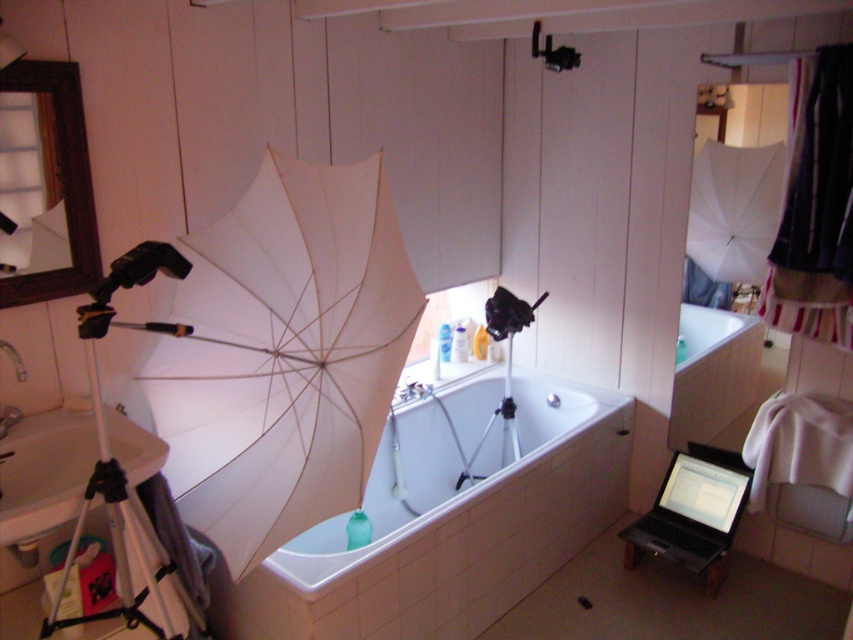
Between point (300, 481) and point (637, 524), which one is positioned behind?

The point (637, 524) is more distant.

The height and width of the screenshot is (640, 853). Describe the element at coordinates (283, 355) in the screenshot. I see `white matte umbrella at center` at that location.

This screenshot has height=640, width=853. I want to click on white matte umbrella at center, so click(283, 355).

Does white matte umbrella at center have a greater width compared to white glossy bathtub at center?

No.

Is white matte umbrella at center positioned before white glossy bathtub at center?

That is True.

What are the coordinates of `white matte umbrella at center` in the screenshot? It's located at pyautogui.click(x=283, y=355).

The width and height of the screenshot is (853, 640). Describe the element at coordinates (283, 355) in the screenshot. I see `white matte umbrella at center` at that location.

Is point (347, 508) positioned after point (166, 262)?

Yes, it is.

Locate an element on the screen. Image resolution: width=853 pixels, height=640 pixels. white matte umbrella at center is located at coordinates (283, 355).